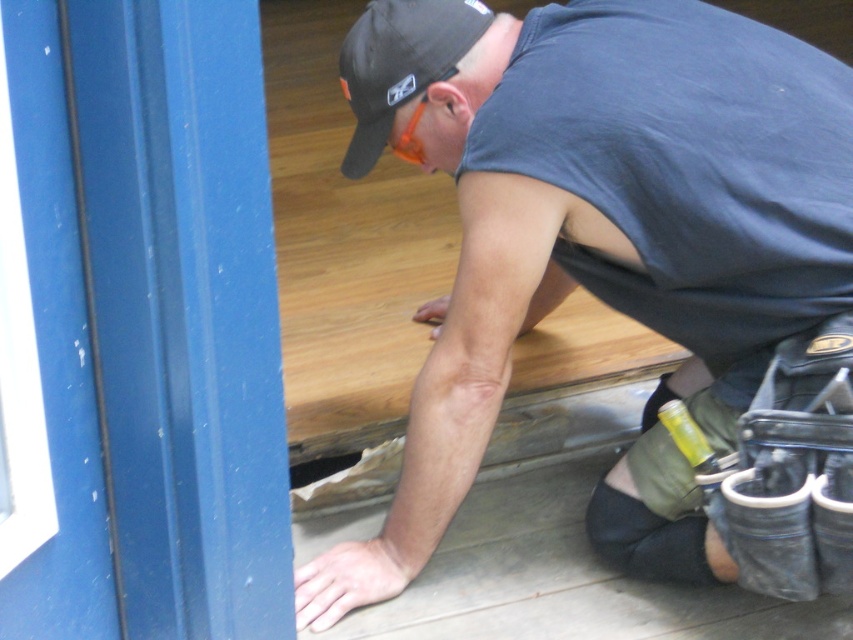
Question: Estimate the real-world distances between objects in this image. Which object is farther from the black fabric baseball cap at upper center?

Choices:
 (A) matte blue door at left
 (B) gray fabric construction worker at center

Answer: (A)

Question: Can you confirm if matte blue door at left is wider than black fabric baseball cap at upper center?

Choices:
 (A) yes
 (B) no

Answer: (A)

Question: Which point is closer to the camera?

Choices:
 (A) (659, 428)
 (B) (113, 426)

Answer: (B)

Question: Is gray fabric construction worker at center further to the viewer compared to matte blue door at left?

Choices:
 (A) yes
 (B) no

Answer: (A)

Question: Is matte blue door at left bigger than black fabric baseball cap at upper center?

Choices:
 (A) no
 (B) yes

Answer: (B)

Question: Which is farther from the matte blue door at left?

Choices:
 (A) gray fabric construction worker at center
 (B) black fabric baseball cap at upper center

Answer: (B)